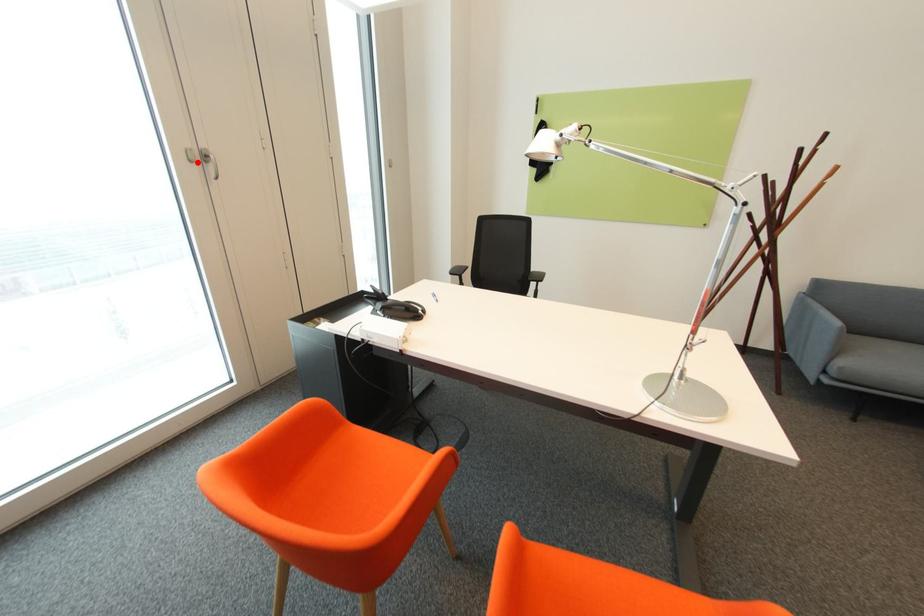
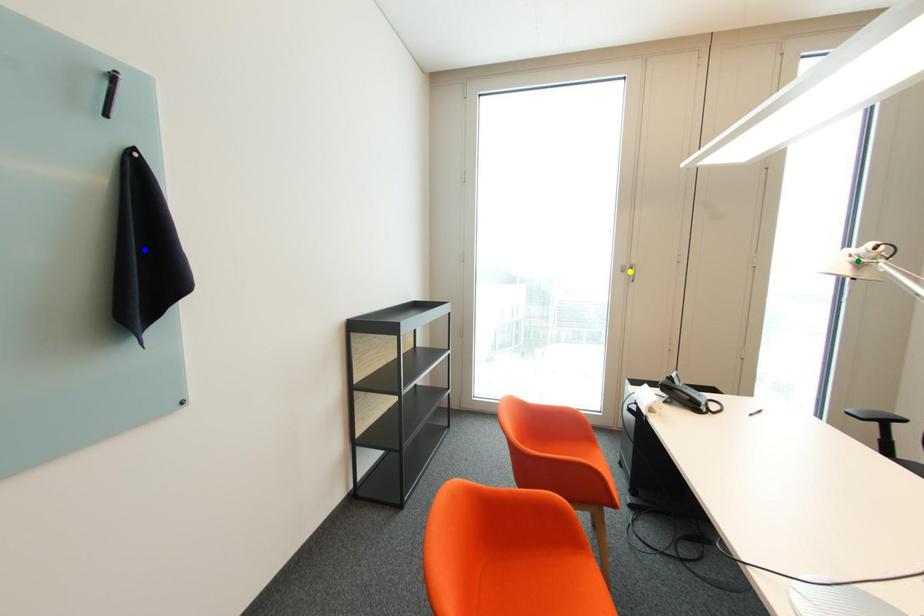
Question: I am providing you with two images of the same scene from different viewpoints. A red point is marked on the first image. You are given multiple points on the second image. Which point in image 2 represents the same 3d spot as the red point in image 1?

Choices:
 (A) green point
 (B) blue point
 (C) yellow point

Answer: (C)